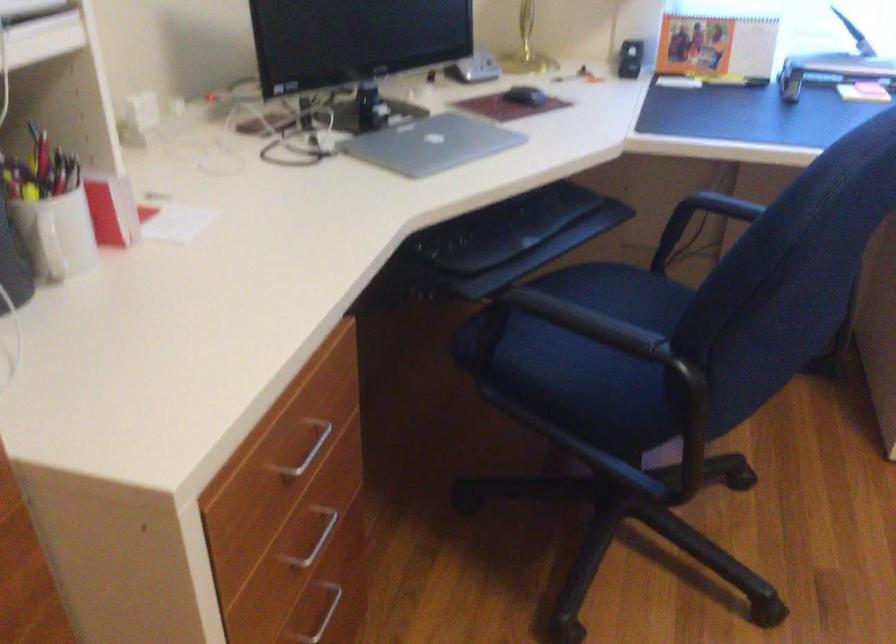
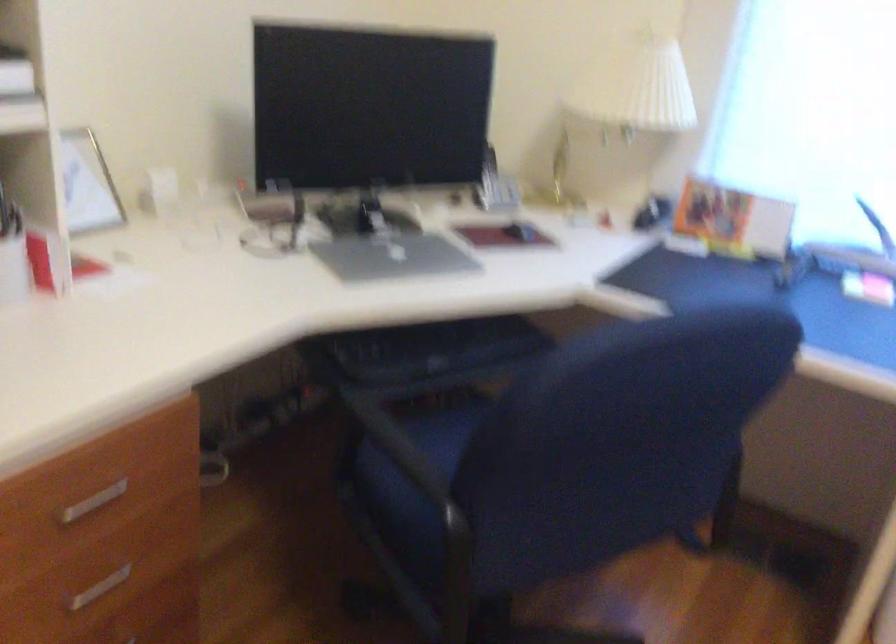
Question: The first image is from the beginning of the video and the second image is from the end. How did the camera likely rotate when shooting the video?

Choices:
 (A) Left
 (B) Right
 (C) Up
 (D) Down

Answer: (A)